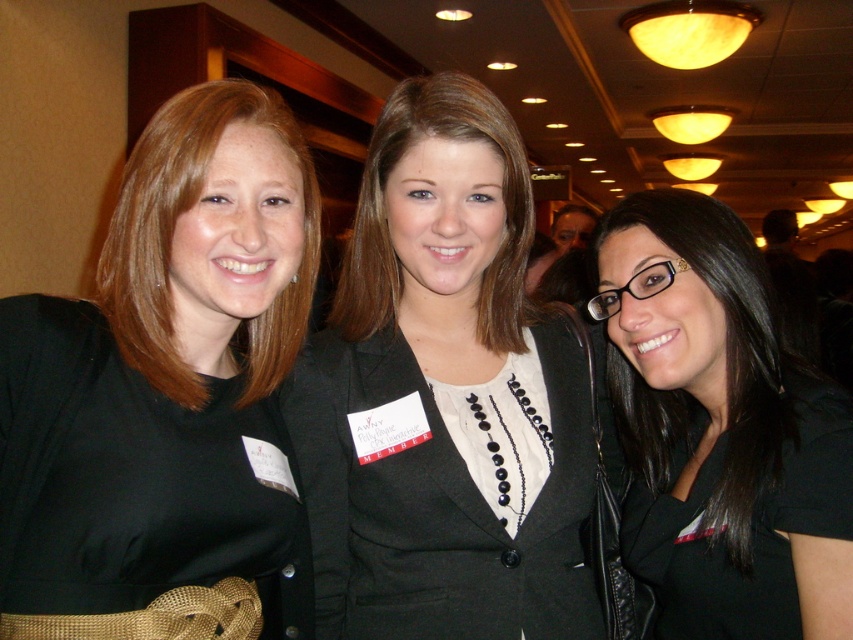
You are organizing a photoshoot and need to place a decorative backdrop behind the matte black dress at center. According to the image coordinates provided, where should you position the backdrop to ensure it aligns perfectly with the dress?

The matte black dress at center is located at point (167, 394), so you should position the backdrop at those coordinates to align with it.

You are a photographer adjusting your camera settings to focus on the woman in the center wearing a matte black dress at center. The camera has a focus point at coordinates point (167, 394). Is this focus point correctly positioned over the matte black dress at center?

Yes, the focus point at point (167, 394) is correctly positioned over the matte black dress at center as stated in the description.